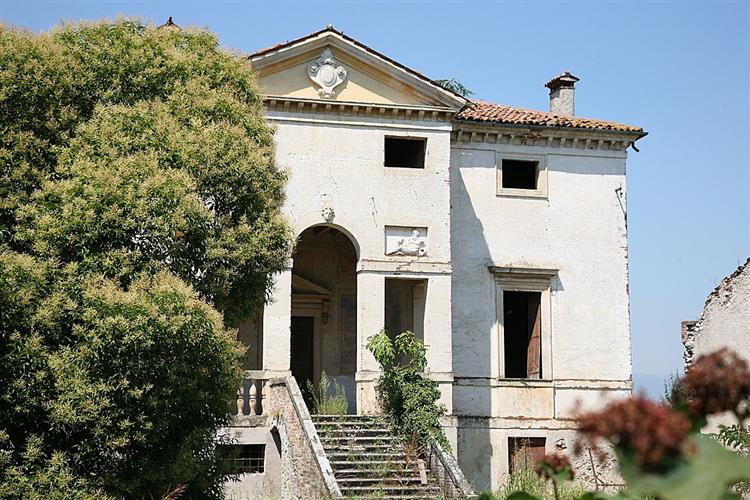
At what (x,y) coordinates should I click in order to perform the action: click on window. Please return your answer as a coordinate pair (x, y). The width and height of the screenshot is (750, 500). Looking at the image, I should click on (526, 309).